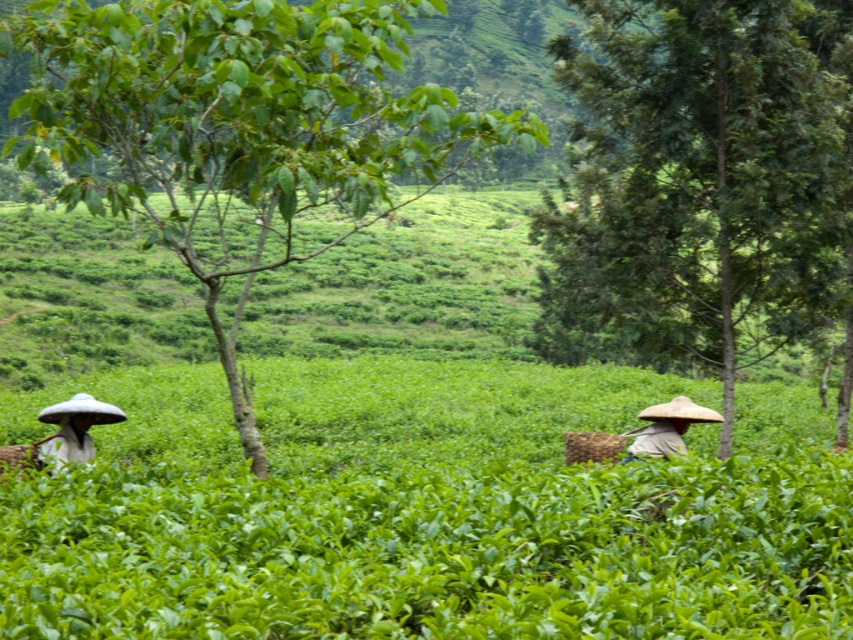
In the scene shown: Who is higher up, green leafy tree at left or light brown straw hat at right?

Positioned higher is green leafy tree at left.

Between green leafy tree at left and light brown straw hat at right, which one has less height?

With less height is light brown straw hat at right.

Does point (229, 358) come farther from viewer compared to point (677, 424)?

That is False.

I want to click on green leafy tree at left, so click(x=238, y=131).

Does green leafy tree at left have a smaller size compared to green leafy tree at right?

No, green leafy tree at left is not smaller than green leafy tree at right.

Does green leafy tree at left come in front of green leafy tree at right?

Yes.

Between point (230, 17) and point (805, 134), which one is positioned in front?

Point (230, 17) is more forward.

The width and height of the screenshot is (853, 640). I want to click on green leafy tree at left, so click(x=238, y=131).

Can you confirm if matte white hat at left is positioned below light brown straw hat at right?

No.

Between matte white hat at left and light brown straw hat at right, which one has less height?

With less height is light brown straw hat at right.

Which is behind, point (97, 410) or point (625, 460)?

The point (97, 410) is more distant.

Identify the location of matte white hat at left. (73, 428).